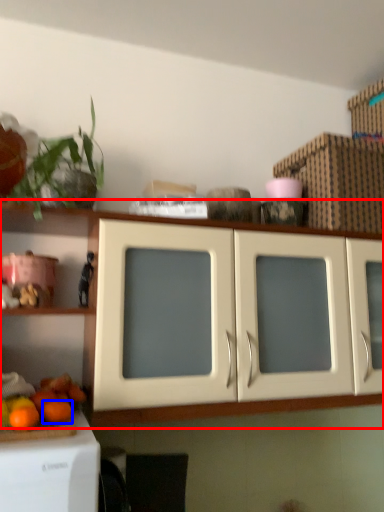
Question: Among these objects, which one is nearest to the camera, cabinetry (highlighted by a red box) or orange (highlighted by a blue box)?

Choices:
 (A) cabinetry
 (B) orange

Answer: (A)